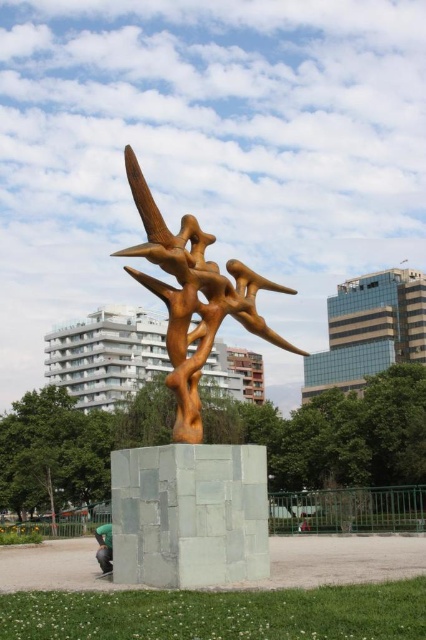
Who is positioned more to the right, bronze/sculpture at center or green fabric person at lower left?

bronze/sculpture at center is more to the right.

In the scene shown: Between bronze/sculpture at center and green fabric person at lower left, which one appears on the left side from the viewer's perspective?

From the viewer's perspective, green fabric person at lower left appears more on the left side.

The height and width of the screenshot is (640, 426). What do you see at coordinates (192, 298) in the screenshot?
I see `bronze/sculpture at center` at bounding box center [192, 298].

Identify the location of bronze/sculpture at center. Image resolution: width=426 pixels, height=640 pixels. (192, 298).